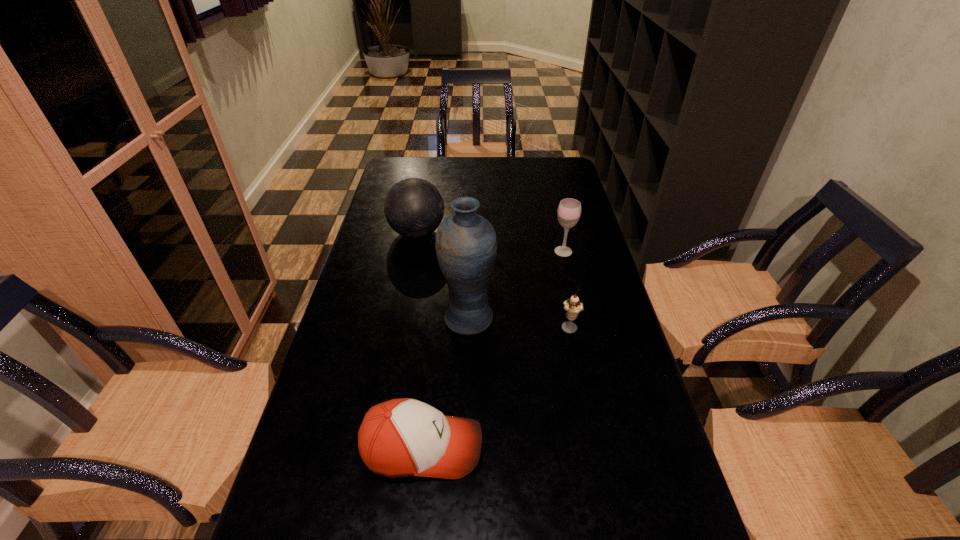
Where is `vacant area that lies between the icecream and the baseball cap`? This screenshot has width=960, height=540. vacant area that lies between the icecream and the baseball cap is located at coordinates (496, 388).

At what (x,y) coordinates should I click in order to perform the action: click on empty space that is in between the wineglass and the icecream. Please return your answer as a coordinate pair (x, y). The width and height of the screenshot is (960, 540). Looking at the image, I should click on (566, 291).

This screenshot has width=960, height=540. In order to click on vacant point located between the nearest object and the icecream in this screenshot , I will do `click(496, 388)`.

Where is `object that is the fourth closest one to the bowling ball`? This screenshot has width=960, height=540. object that is the fourth closest one to the bowling ball is located at coordinates (405, 437).

The height and width of the screenshot is (540, 960). Identify the location of object identified as the fourth closest to the tallest object. (569, 210).

Find the location of a particular element. This screenshot has height=540, width=960. free location that satisfies the following two spatial constraints: 1. on the front side of the vase; 2. on the front-facing side of the nearest object is located at coordinates (465, 447).